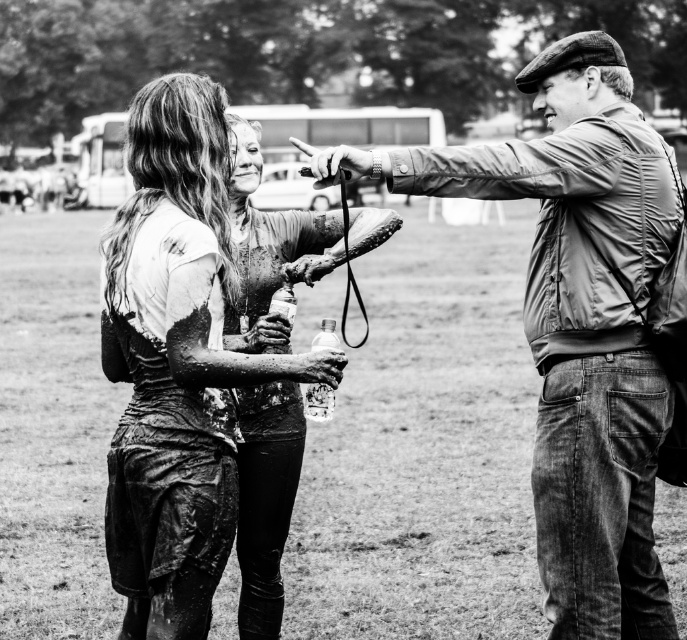
You are organizing a mud run event and need to ensure that participants can distinguish between the clean and muddy jackets. Given the scene described, which jacket is taller, the leather jacket at right or the muddy leather jacket at center?

The leather jacket at right is taller than the muddy leather jacket at center according to the description.